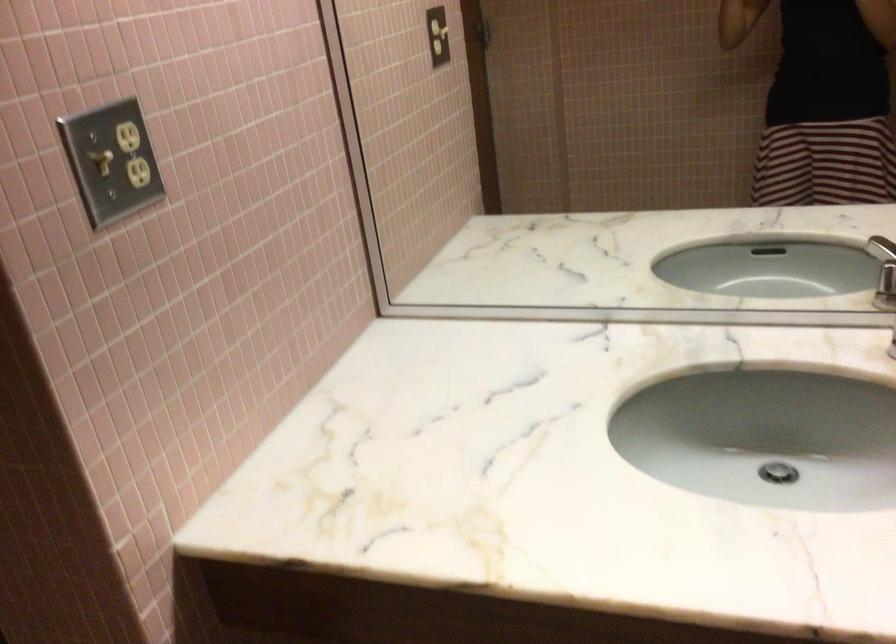
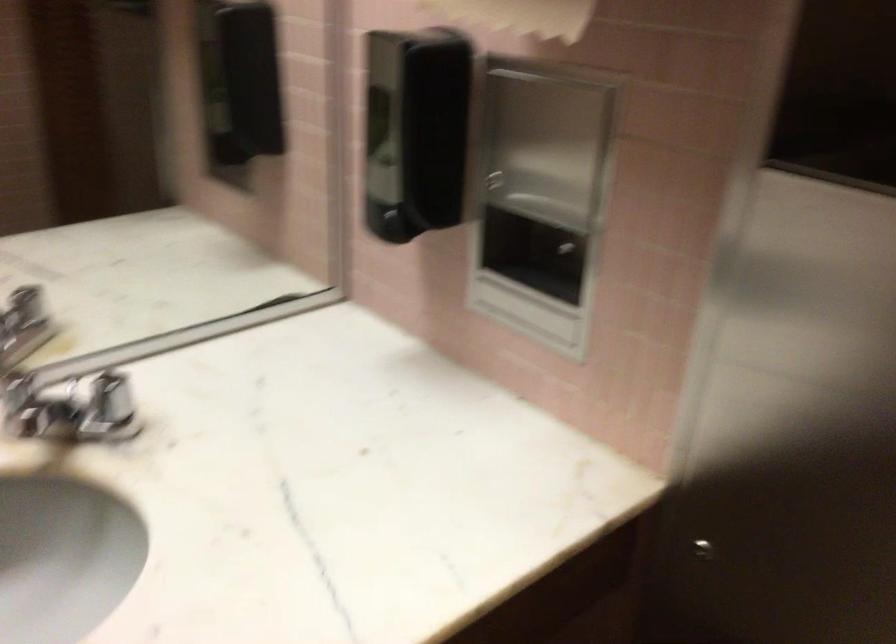
Question: The first image is from the beginning of the video and the second image is from the end. How did the camera likely rotate when shooting the video?

Choices:
 (A) Left
 (B) Right
 (C) Up
 (D) Down

Answer: (B)